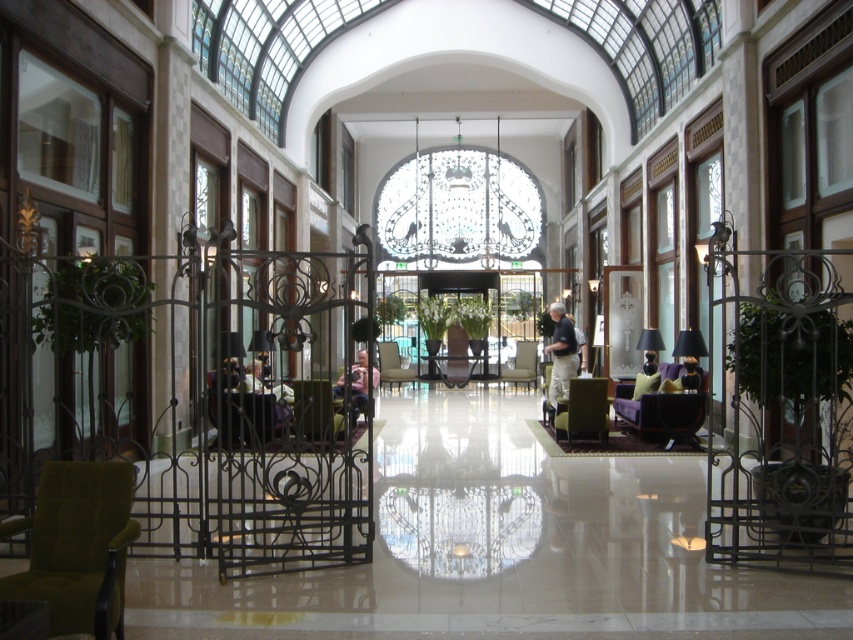
Question: Among these objects, which one is nearest to the camera?

Choices:
 (A) light beige fabric armchair at center
 (B) green fabric armchair at center
 (C) matte black lamp at right
 (D) velvet green armchair at center

Answer: (D)

Question: Which point is farther from the camera taking this photo?

Choices:
 (A) click(96, 467)
 (B) click(648, 417)

Answer: (B)

Question: Which of the following is the farthest from the observer?

Choices:
 (A) matte gray armchair at center
 (B) matte black lamp at right
 (C) velvet dark brown armchair at center

Answer: (A)

Question: Is matte green armchair at center to the right of velvet green armchair at center from the viewer's perspective?

Choices:
 (A) yes
 (B) no

Answer: (A)

Question: Is velvet purple armchair at right to the right of light beige pants at center from the viewer's perspective?

Choices:
 (A) no
 (B) yes

Answer: (B)

Question: Is light beige pants at center wider than green fabric armchair at center?

Choices:
 (A) yes
 (B) no

Answer: (A)